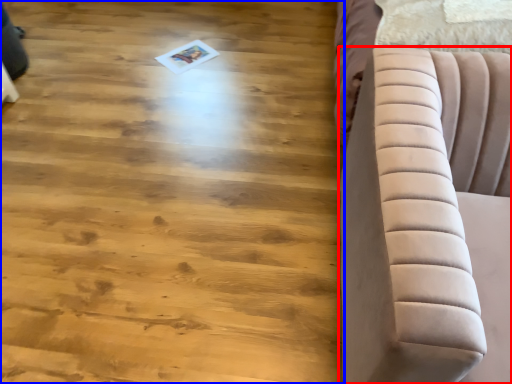
Question: Among these objects, which one is nearest to the camera, furniture (highlighted by a red box) or hardwood (highlighted by a blue box)?

Choices:
 (A) furniture
 (B) hardwood

Answer: (A)